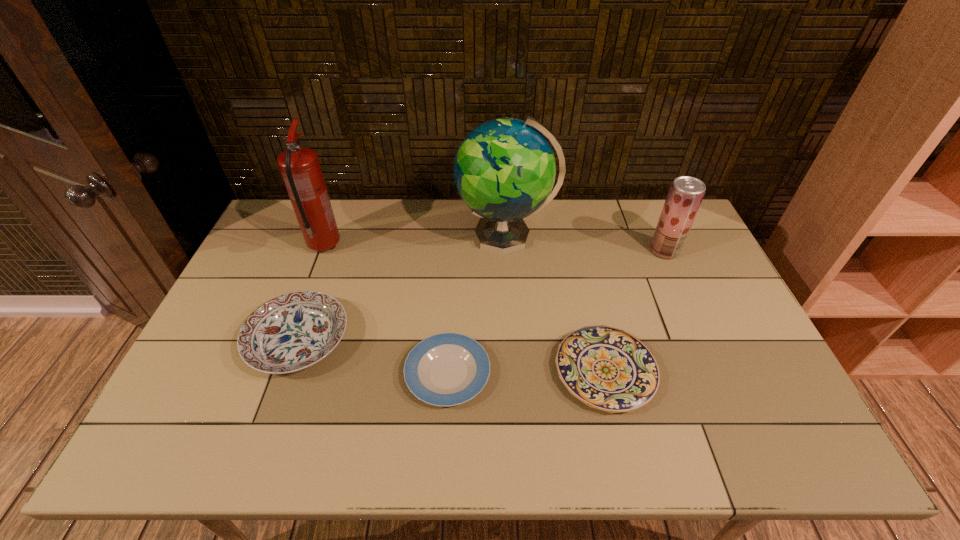
Locate an element on the screen. This screenshot has width=960, height=540. fruit juice located at the far edge is located at coordinates [x=686, y=193].

This screenshot has height=540, width=960. In order to click on object that is at the left edge in this screenshot , I will do `click(293, 331)`.

I want to click on object at the right edge, so click(686, 193).

Identify the location of object that is at the far right corner. Image resolution: width=960 pixels, height=540 pixels. (686, 193).

Where is `vacant space at the far edge`? Image resolution: width=960 pixels, height=540 pixels. vacant space at the far edge is located at coordinates (458, 231).

Locate an element on the screen. This screenshot has width=960, height=540. vacant region at the near edge of the desktop is located at coordinates (235, 450).

Image resolution: width=960 pixels, height=540 pixels. Identify the location of vacant space at the left edge of the desktop. (219, 360).

At what (x,y) coordinates should I click in order to perform the action: click on free space at the right edge. Please return your answer as a coordinate pair (x, y). Looking at the image, I should click on (679, 288).

Find the location of `vacant space in between the tallest plate and the globe`. vacant space in between the tallest plate and the globe is located at coordinates (402, 288).

Identify the location of unoccupied area between the rightmost plate and the fruit juice. (635, 311).